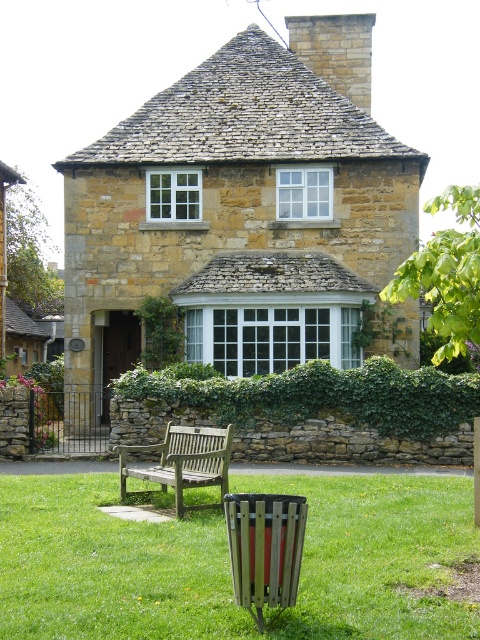
Is point (274, 168) positioned in front of point (227, 436)?

No, (274, 168) is further to viewer.

What do you see at coordinates (244, 211) in the screenshot?
I see `stone textured cottage at center` at bounding box center [244, 211].

Where is `stone textured cottage at center`? stone textured cottage at center is located at coordinates (244, 211).

The image size is (480, 640). Identify the location of green grass at lower center. (108, 566).

Which is above, green grass at lower center or green ivy hedge at center?

green ivy hedge at center is above.

Does point (439, 486) come farther from viewer compared to point (375, 410)?

That is False.

Locate an element on the screen. This screenshot has width=480, height=640. green grass at lower center is located at coordinates (108, 566).

Can you confirm if green ivy hedge at center is positioned to the left of wooden bench at center?

In fact, green ivy hedge at center is to the right of wooden bench at center.

Can you confirm if green ivy hedge at center is bigger than wooden bench at center?

Incorrect, green ivy hedge at center is not larger than wooden bench at center.

Describe the element at coordinates (322, 396) in the screenshot. The width and height of the screenshot is (480, 640). I see `green ivy hedge at center` at that location.

This screenshot has width=480, height=640. I want to click on green ivy hedge at center, so click(x=322, y=396).